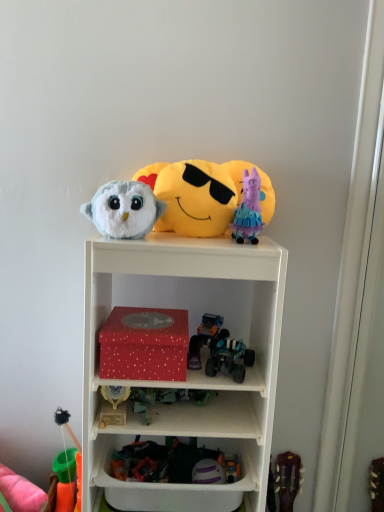
Question: Should I look upward or downward to see fluffy white owl at upper center, arranged as the 3th toy when viewed from the top?

Choices:
 (A) up
 (B) down

Answer: (A)

Question: Is metallic green toy car at center, the sixth toy when ordered from top to bottom, not near fluffy white owl at upper center, the 7th toy ordered from the bottom?

Choices:
 (A) yes
 (B) no

Answer: (B)

Question: Can you confirm if metallic green toy car at center, the sixth toy when ordered from top to bottom, is positioned to the right of fluffy white owl at upper center, the 7th toy ordered from the bottom?

Choices:
 (A) no
 (B) yes

Answer: (B)

Question: Can you confirm if metallic green toy car at center, the sixth toy when ordered from top to bottom, is smaller than fluffy white owl at upper center, the 7th toy ordered from the bottom?

Choices:
 (A) no
 (B) yes

Answer: (B)

Question: From a real-world perspective, is metallic green toy car at center, the sixth toy when ordered from top to bottom, on fluffy white owl at upper center, the 7th toy ordered from the bottom?

Choices:
 (A) yes
 (B) no

Answer: (B)

Question: Is metallic green toy car at center, acting as the 4th toy starting from the bottom, wider than fluffy white owl at upper center, the 7th toy ordered from the bottom?

Choices:
 (A) no
 (B) yes

Answer: (B)

Question: Is metallic green toy car at center, the sixth toy when ordered from top to bottom, in contact with fluffy white owl at upper center, arranged as the 3th toy when viewed from the top?

Choices:
 (A) yes
 (B) no

Answer: (B)

Question: From the image's perspective, would you say fluffy white owl at upper center, arranged as the 3th toy when viewed from the top, is shown under shiny metallic truck at center, the sixth toy from the bottom?

Choices:
 (A) yes
 (B) no

Answer: (B)

Question: Is fluffy white owl at upper center, the 7th toy ordered from the bottom, completely or partially outside of shiny metallic truck at center, arranged as the fourth toy when viewed from the top?

Choices:
 (A) no
 (B) yes

Answer: (B)

Question: Could you tell me if fluffy white owl at upper center, the 7th toy ordered from the bottom, is facing shiny metallic truck at center, arranged as the fourth toy when viewed from the top?

Choices:
 (A) no
 (B) yes

Answer: (A)

Question: Considering the relative positions of fluffy white owl at upper center, arranged as the 3th toy when viewed from the top, and shiny metallic truck at center, arranged as the fourth toy when viewed from the top, in the image provided, is fluffy white owl at upper center, arranged as the 3th toy when viewed from the top, to the left of shiny metallic truck at center, arranged as the fourth toy when viewed from the top, from the viewer's perspective?

Choices:
 (A) yes
 (B) no

Answer: (A)

Question: Does fluffy white owl at upper center, arranged as the 3th toy when viewed from the top, have a greater width compared to shiny metallic truck at center, arranged as the fourth toy when viewed from the top?

Choices:
 (A) yes
 (B) no

Answer: (B)

Question: From a real-world perspective, does fluffy white owl at upper center, the 7th toy ordered from the bottom, stand above shiny metallic truck at center, the sixth toy from the bottom?

Choices:
 (A) yes
 (B) no

Answer: (A)

Question: Is purple fabric pig at upper center, which is counted as the 9th toy, starting from the bottom, a part of yellow plush at upper center, the eighth toy positioned from the bottom?

Choices:
 (A) no
 (B) yes

Answer: (A)